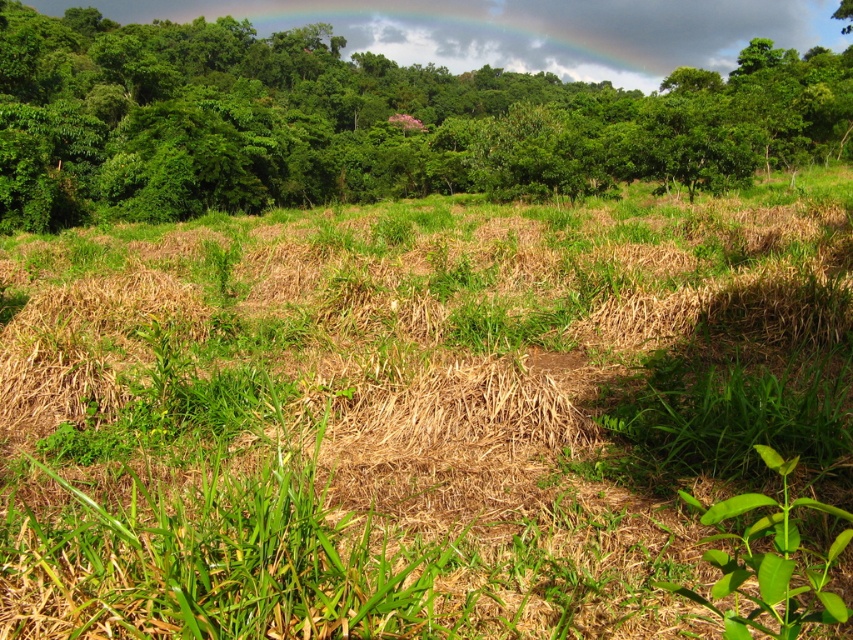
You are standing at the point marked as point [579,333] in the image. You need to walk to the edge of the field which is 25 feet away from your current position. Will you reach the edge before walking 25 feet?

The distance between point [579,333] and the viewer is 21.99 feet. Since the edge of the field is 25 feet away from your current position, you will reach the edge before walking 25 feet because 21.99 feet is less than 25 feet.

You are standing in the vibrant natural landscape and want to walk from the green grassy field at center to the green leafy tree at upper center. Which direction should you move to get closer to the tree?

You should move away from the green grassy field at center towards the green leafy tree at upper center since the tree is further away from you than the field.